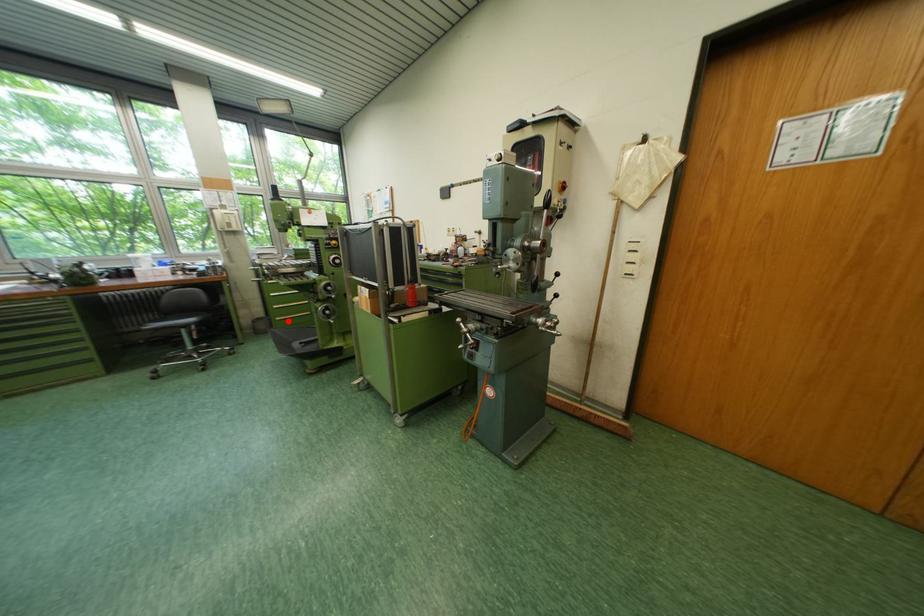
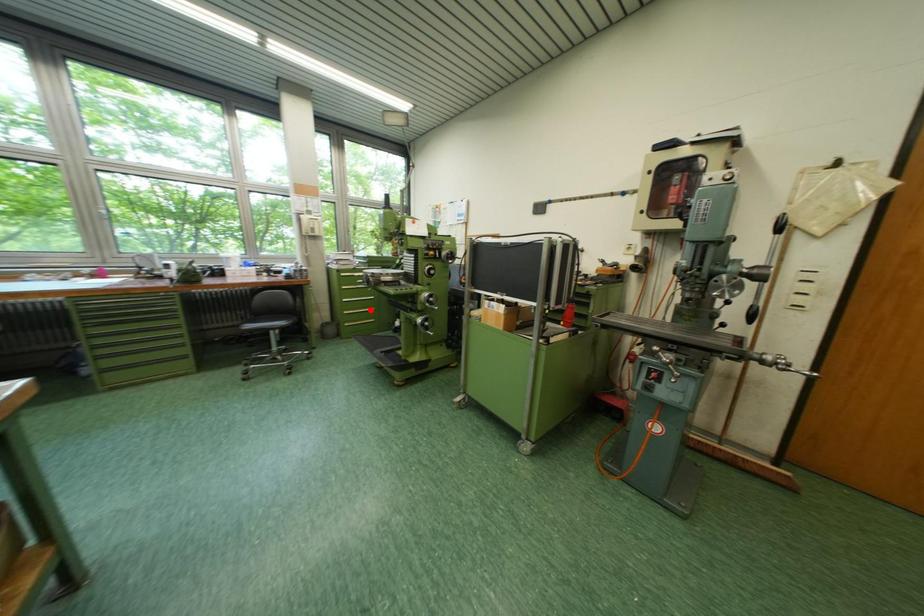
I am providing you with two images of the same scene from different viewpoints. A red point is marked on the first image and another point is marked on the second image. Does the point marked in image1 correspond to the same location as the one in image2?

No